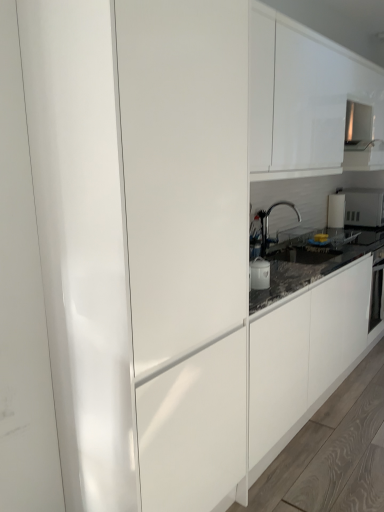
The width and height of the screenshot is (384, 512). I want to click on free space in front of white glossy pot at center, the 2th appliance when ordered from back to front, so click(260, 290).